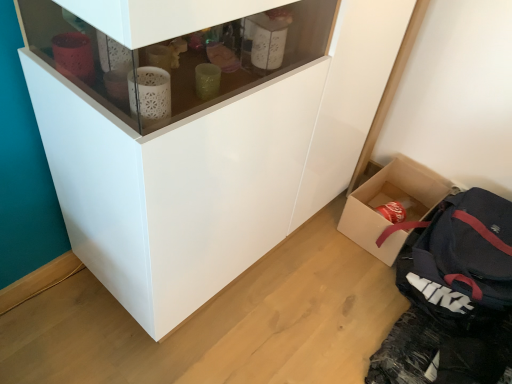
Question: Looking at their shapes, would you say dark blue fabric backpack at lower right is wider or thinner than cardboard box at lower right?

Choices:
 (A) wide
 (B) thin

Answer: (A)

Question: Is dark blue fabric backpack at lower right to the left or to the right of cardboard box at lower right in the image?

Choices:
 (A) right
 (B) left

Answer: (A)

Question: Based on their relative distances, which object is nearer to the cardboard box at lower right?

Choices:
 (A) dark blue fabric backpack at lower right
 (B) white glossy cupboard at center

Answer: (A)

Question: Which object is the farthest from the cardboard box at lower right?

Choices:
 (A) white glossy cupboard at center
 (B) dark blue fabric backpack at lower right

Answer: (A)